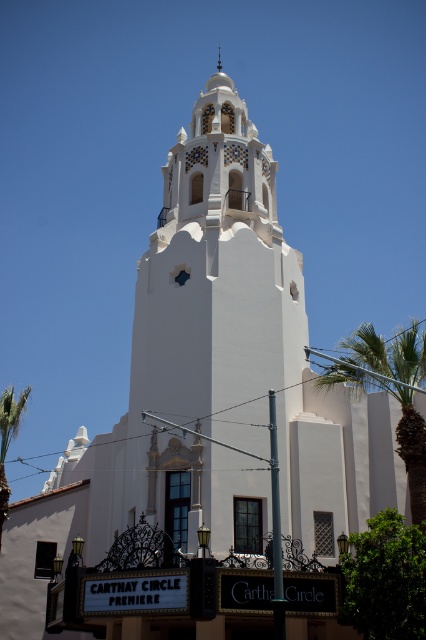
Question: Is white stucco bell tower at center thinner than green leafy palm tree at right?

Choices:
 (A) no
 (B) yes

Answer: (B)

Question: Can you confirm if white stucco bell tower at center is positioned above green leafy palm tree at right?

Choices:
 (A) no
 (B) yes

Answer: (B)

Question: Which point appears closest to the camera in this image?

Choices:
 (A) coord(420,358)
 (B) coord(239,211)

Answer: (A)

Question: Does white stucco bell tower at center have a lesser width compared to green leafy palm tree at right?

Choices:
 (A) yes
 (B) no

Answer: (A)